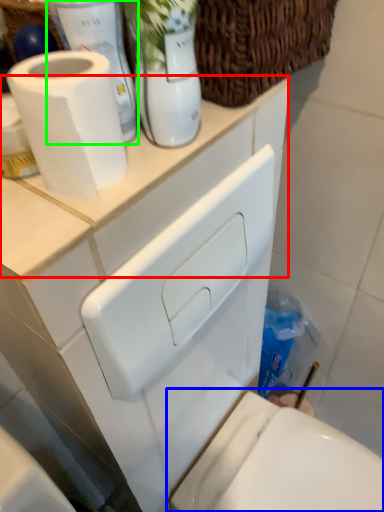
Question: Estimate the real-world distances between objects in this image. Which object is farther from counter top (highlighted by a red box), toilet (highlighted by a blue box) or bottle (highlighted by a green box)?

Choices:
 (A) toilet
 (B) bottle

Answer: (A)